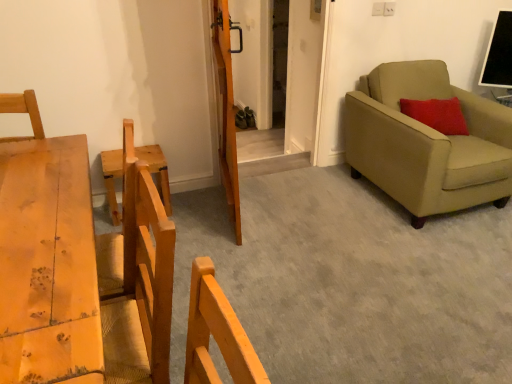
Question: From the image's perspective, is wooden chair at left located above light brown wooden table at left?

Choices:
 (A) yes
 (B) no

Answer: (A)

Question: Could light brown wooden table at left be considered to be inside wooden chair at left?

Choices:
 (A) yes
 (B) no

Answer: (B)

Question: Is wooden chair at left thinner than light brown wooden table at left?

Choices:
 (A) yes
 (B) no

Answer: (A)

Question: Considering the relative sizes of wooden chair at left and light brown wooden table at left in the image provided, is wooden chair at left bigger than light brown wooden table at left?

Choices:
 (A) no
 (B) yes

Answer: (A)

Question: Considering the relative positions of wooden chair at left and light brown wooden table at left in the image provided, is wooden chair at left to the right of light brown wooden table at left from the viewer's perspective?

Choices:
 (A) no
 (B) yes

Answer: (A)

Question: Is wooden chair at left positioned behind light brown wooden table at left?

Choices:
 (A) no
 (B) yes

Answer: (B)

Question: Is wooden door at center next to wooden chair at left and touching it?

Choices:
 (A) no
 (B) yes

Answer: (A)

Question: From a real-world perspective, is wooden door at center on wooden chair at left?

Choices:
 (A) yes
 (B) no

Answer: (A)

Question: Does wooden door at center have a lesser width compared to wooden chair at left?

Choices:
 (A) no
 (B) yes

Answer: (B)

Question: Considering the relative positions of wooden door at center and wooden chair at left in the image provided, is wooden door at center in front of wooden chair at left?

Choices:
 (A) no
 (B) yes

Answer: (B)

Question: Is wooden door at center not close to wooden chair at left?

Choices:
 (A) no
 (B) yes

Answer: (A)

Question: Is wooden door at center looking in the opposite direction of wooden chair at left?

Choices:
 (A) no
 (B) yes

Answer: (B)

Question: Does wooden barn door at center touch light brown wooden table at left?

Choices:
 (A) no
 (B) yes

Answer: (A)